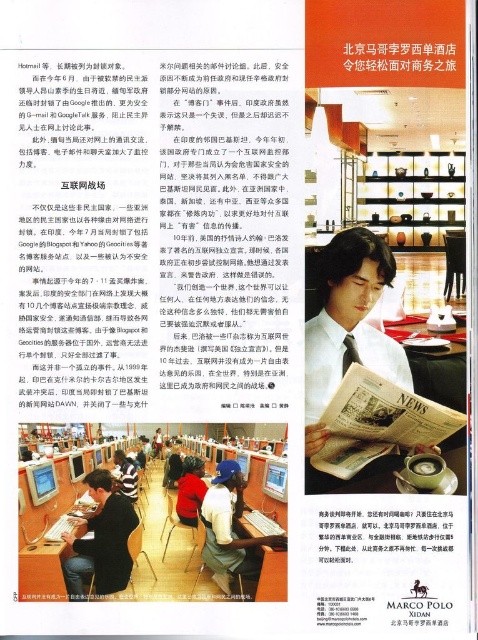
You are a researcher looking for a quiet place to work. You see the wooden shelves at center and the matte black laptop at center. Which object is positioned higher up?

The wooden shelves at center are positioned higher up than the matte black laptop at center.

Looking at this image, you are a graphic designer working on this magazine layout. You need to ensure that the matte black hair at center and the matte black laptop at lower left are visually balanced. Which object should you adjust in size to achieve this balance?

The matte black laptop at lower left should be made taller since the matte black hair at center is taller than it, so increasing the laptop size would help balance them.